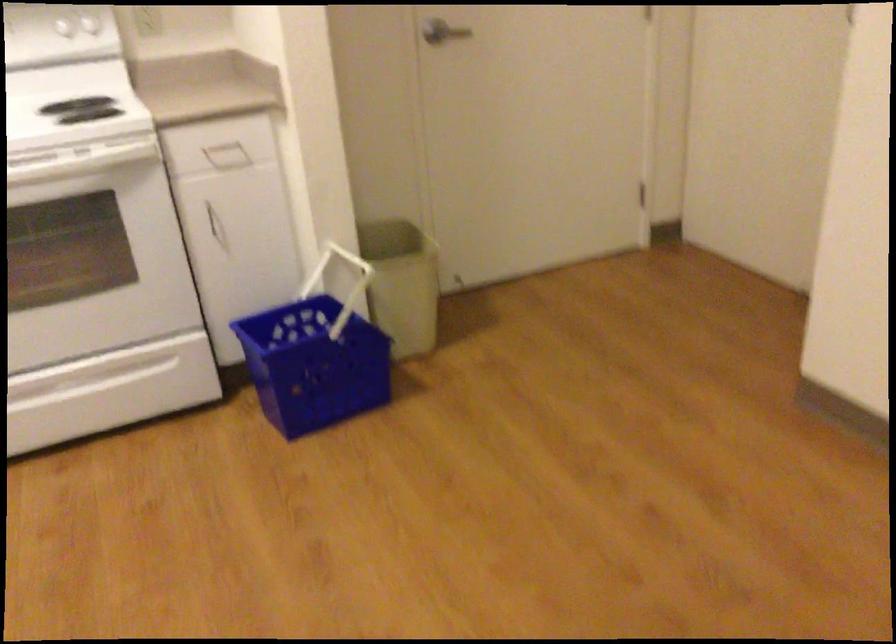
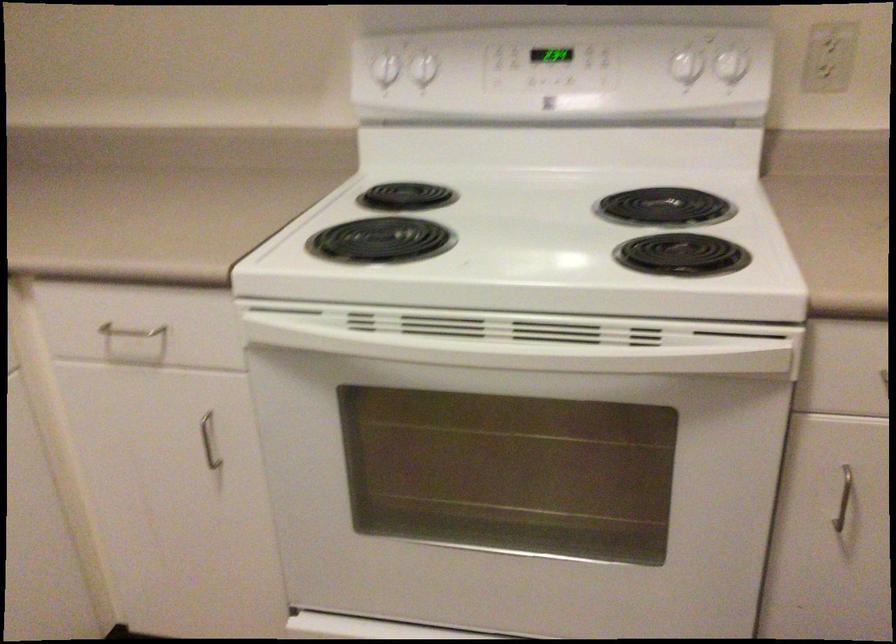
Find the pixel in the second image that matches the point at 81,104 in the first image.

(664, 207)